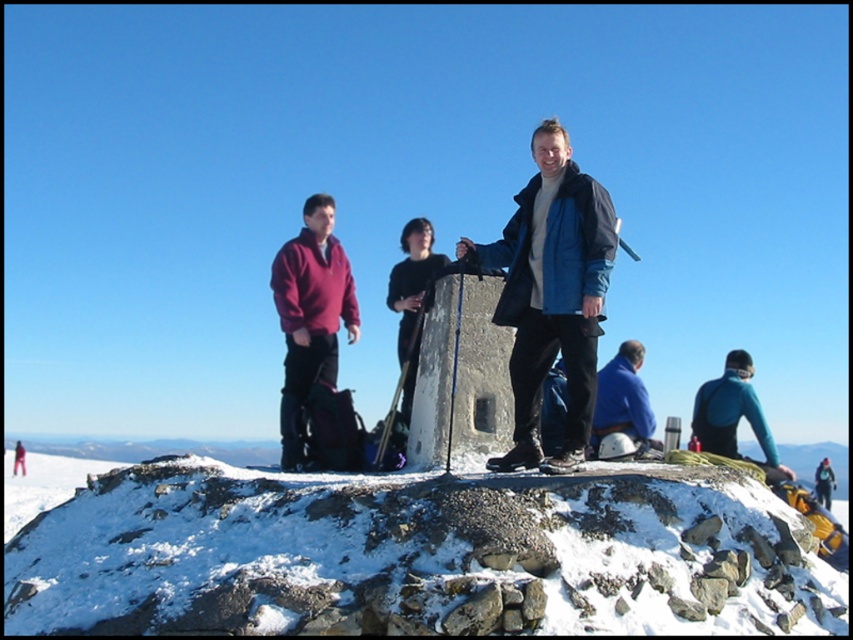
You are a photographer trying to capture both the maroon fleece at left and the blue fabric jacket at center in a single shot. Which clothing item should you focus on first to ensure both are in frame?

The maroon fleece at left is shorter than the blue fabric jacket at center, so you should focus on the blue fabric jacket at center first to ensure both are in frame.

You are planning to place a small flag on the highest point between the white powdery snow at center and the matte blue jacket at center. Which object should you choose to place the flag on?

The matte blue jacket at center is taller than the white powdery snow at center, so you should place the flag on the matte blue jacket at center.

Looking at this image, you are a hiker who wants to choose the warmest clothing item between the maroon fleece at left and the blue fabric jacket at center. Which one should you pick?

The blue fabric jacket at center is thicker than the maroon fleece at left, so you should pick the blue fabric jacket at center for warmth.